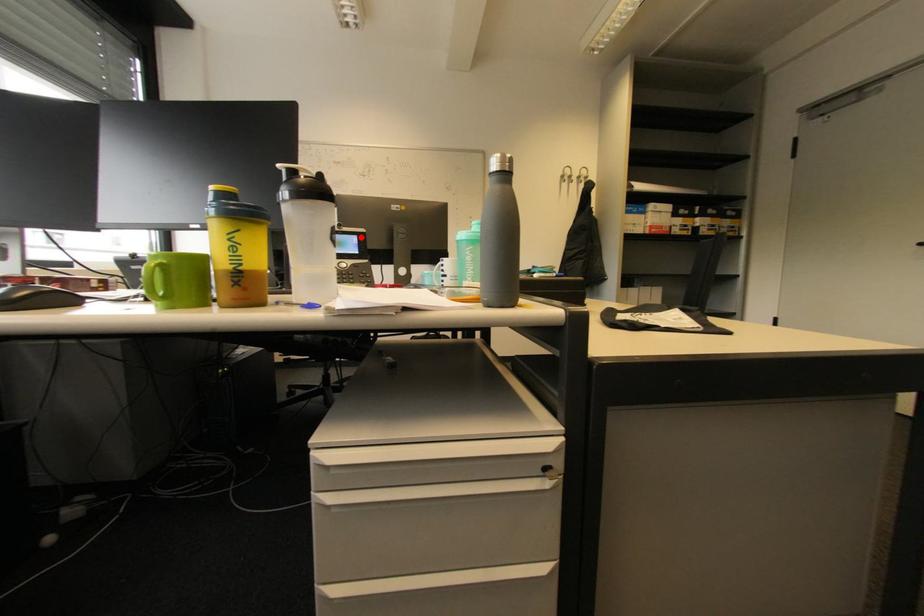
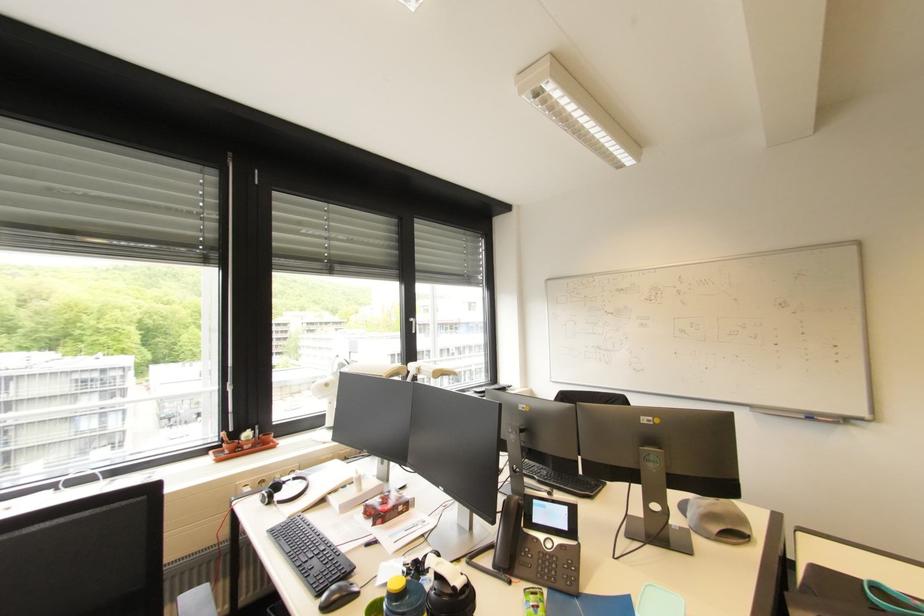
In the second image, find the point that corresponds to the highlighted location in the first image.

(572, 509)